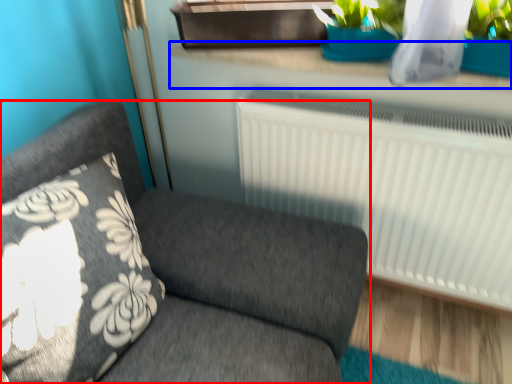
Question: Among these objects, which one is farthest to the camera, furniture (highlighted by a red box) or window sill (highlighted by a blue box)?

Choices:
 (A) furniture
 (B) window sill

Answer: (B)